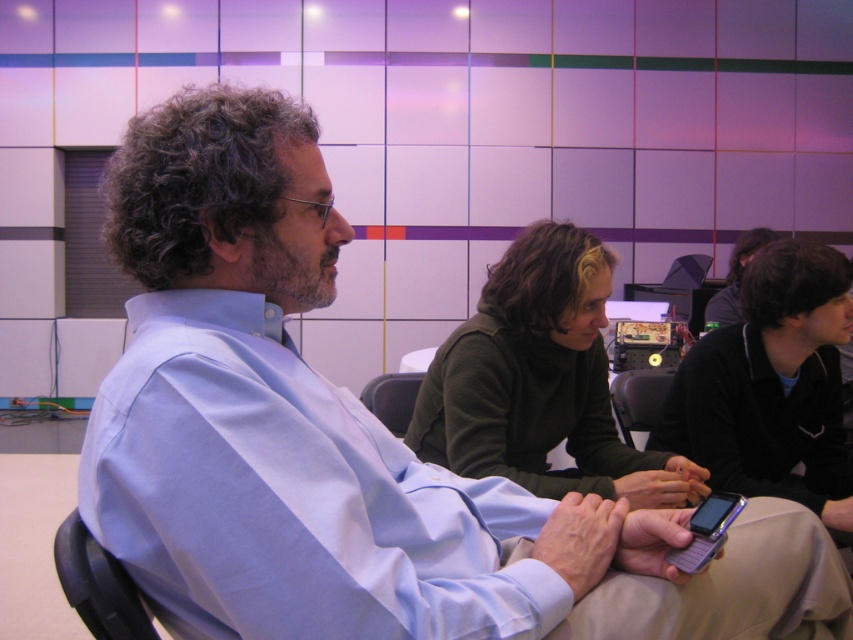
Does black matte phone at center have a smaller size compared to gray plastic chair at center?

Incorrect, black matte phone at center is not smaller in size than gray plastic chair at center.

Where is `black matte phone at center`? black matte phone at center is located at coordinates (772, 385).

In the scene shown: Is black matte phone at center bigger than black plastic chair at center?

Yes, black matte phone at center is bigger than black plastic chair at center.

You are a GUI agent. You are given a task and a screenshot of the screen. Output one action in this format:
    pyautogui.click(x=<x>, y=<y>)
    Task: Click on the black matte phone at center
    This screenshot has height=640, width=853.
    Given the screenshot: What is the action you would take?
    pyautogui.click(x=772, y=385)

Between point (674, 433) and point (641, 412), which one is positioned in front?

Point (674, 433)

Where is `black matte phone at center`? black matte phone at center is located at coordinates (772, 385).

Locate an element on the screen. The image size is (853, 640). black plastic chair at center is located at coordinates (637, 397).

Where is `black plastic chair at center`? The width and height of the screenshot is (853, 640). black plastic chair at center is located at coordinates (637, 397).